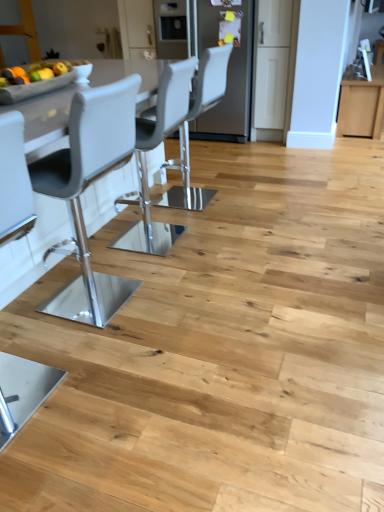
Find the location of a particular element. vacant area to the right of matte gray chair at left, the 2th chair when ordered from right to left is located at coordinates (109, 403).